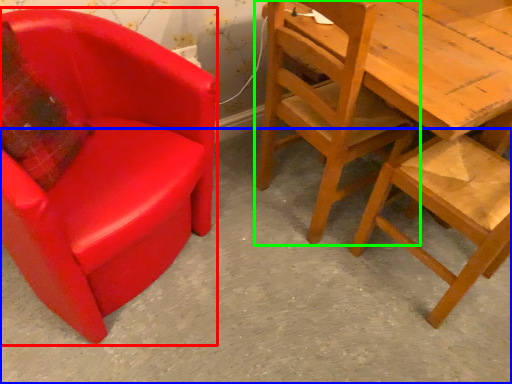
Question: Estimate the real-world distances between objects in this image. Which object is farther from chair (highlighted by a red box), concrete (highlighted by a blue box) or chair (highlighted by a green box)?

Choices:
 (A) concrete
 (B) chair

Answer: (B)